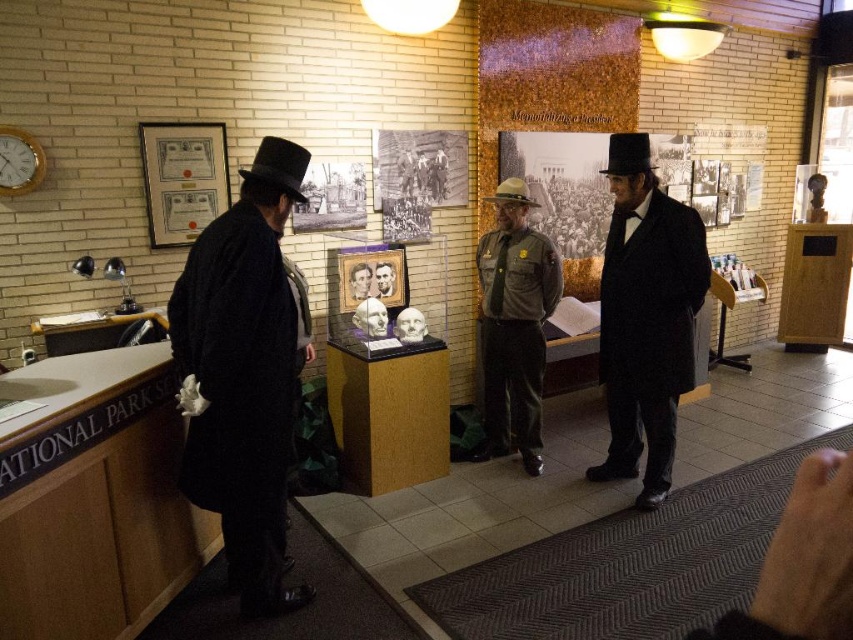
You are standing in the museum and want to take a photo of both point [691,348] and point [550,269] in the image. Which point should you focus on first to ensure both are in clear view?

You should focus on point [691,348] first because it is closer to the camera than point [550,269], ensuring both points remain in focus when using depth of field.

You are an event planner setting up a historical reenactment. You need to place the brown felt dress hat at center and the smooth brown leather hat at center on a display stand. Which hat should be placed on top to match the arrangement in the image?

The brown felt dress hat at center should be placed on top of the smooth brown leather hat at center, as it is positioned over it in the image.